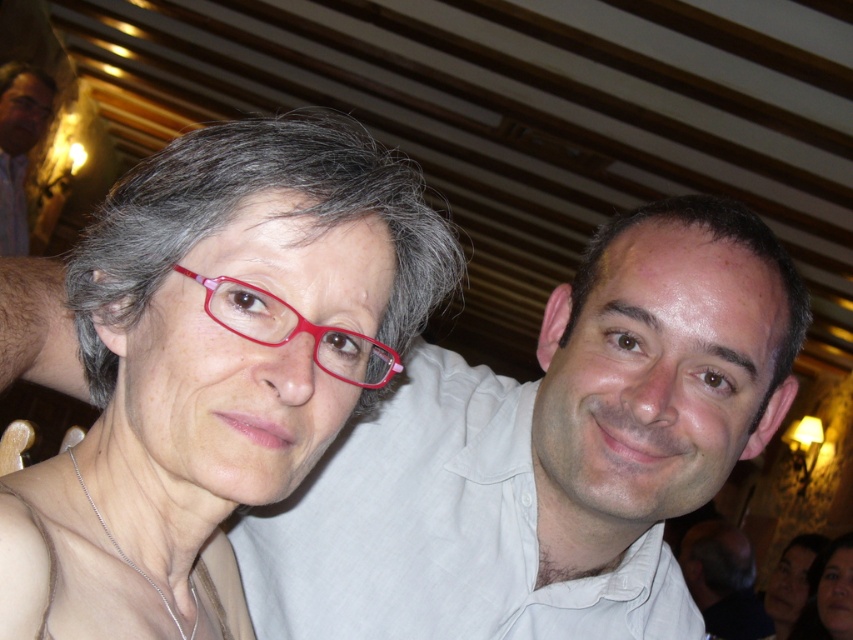
You are a photographer adjusting the focus of your camera. You need to ensure that both the matte pink glasses at upper left and the matte black hair at lower right are in focus. Given their sizes, which object should you prioritize focusing on first to ensure clarity?

The matte pink glasses at upper left has a smaller size compared to matte black hair at lower right. Since smaller objects require more precise focusing, you should prioritize focusing on the matte pink glasses at upper left first to ensure clarity.

You are a photographer at a social event and need to capture a closeup shot of both the matte pink glasses at upper left and the matte black hair at lower right. Given their distance, would you need to use a zoom lens to ensure both are in frame?

The matte pink glasses at upper left is 3.71 meters away from the matte black hair at lower right. To capture both in a single closeup shot, a zoom lens would be necessary to reduce the apparent distance between them and fit both subjects into the frame.